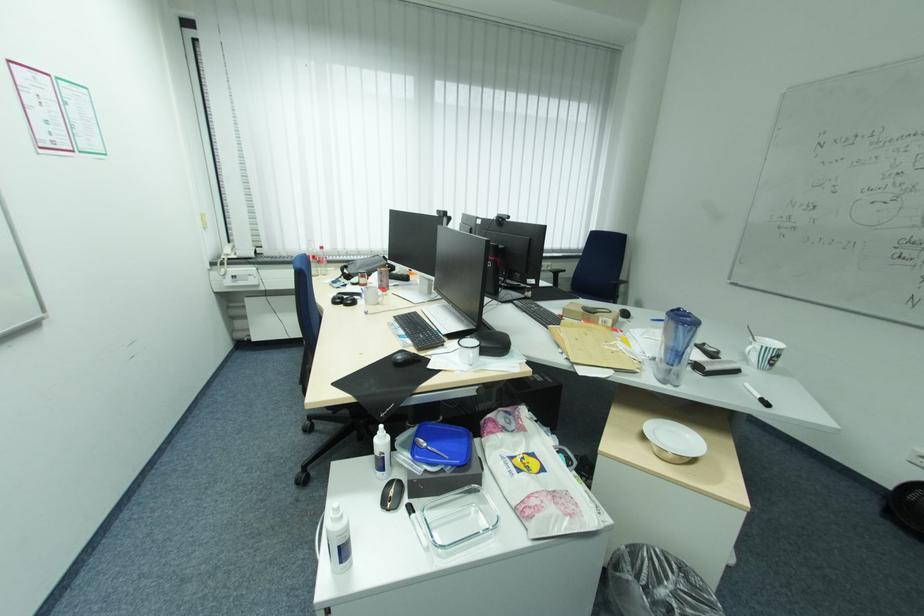
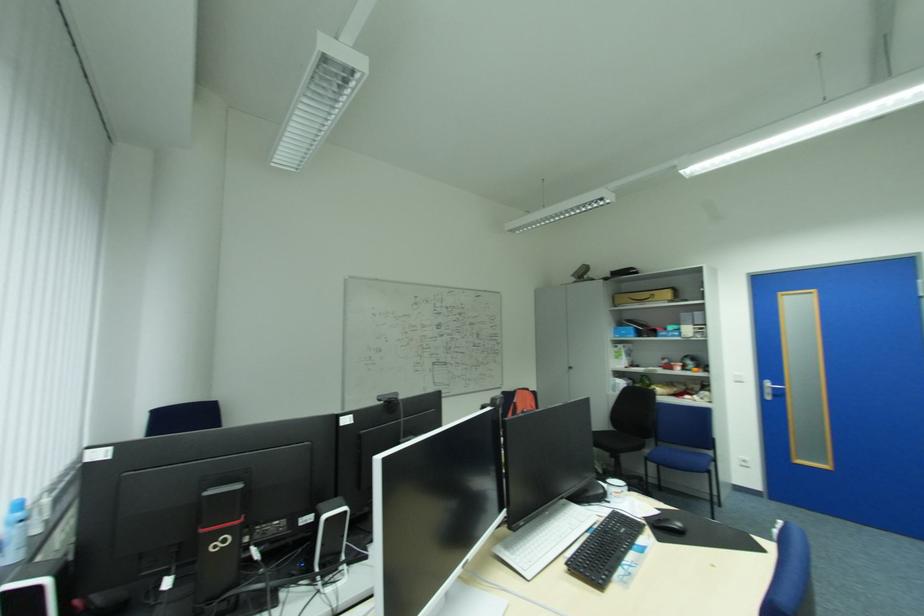
In the second image, find the point that corresponds to the point at 430,354 in the first image.

(652, 524)